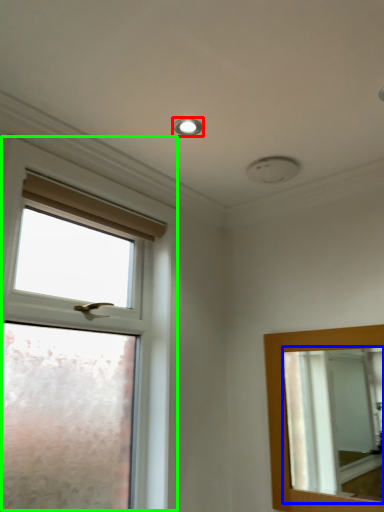
Question: Considering the real-world distances, which object is farthest from droplight (highlighted by a red box)? mirror (highlighted by a blue box) or window (highlighted by a green box)?

Choices:
 (A) mirror
 (B) window

Answer: (A)